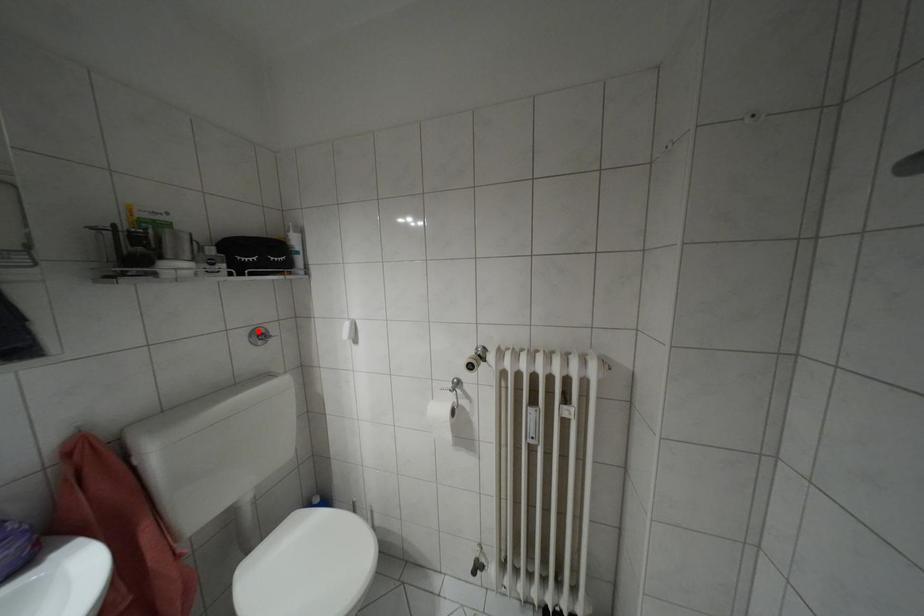
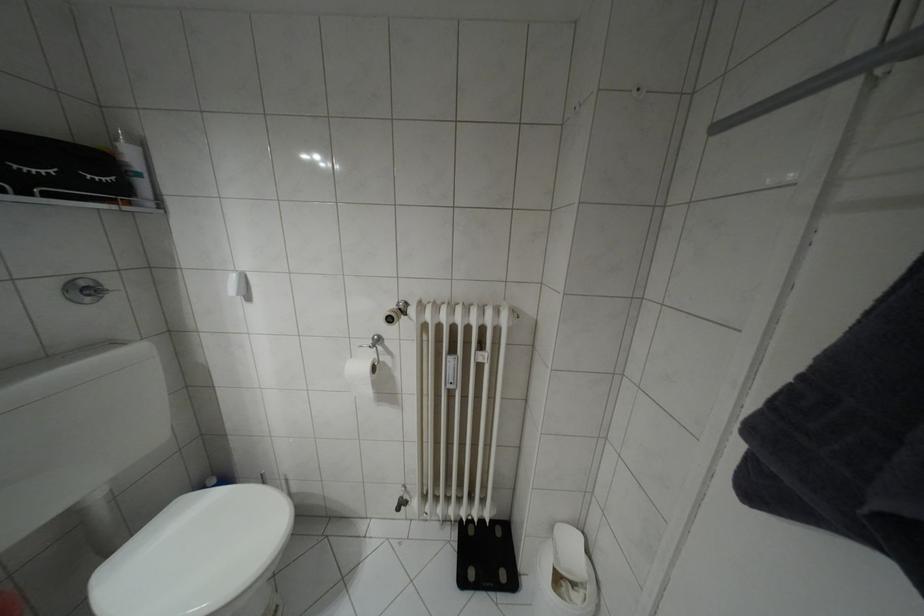
Question: I am providing you with two images of the same scene from different viewpoints. A red point is marked on the first image. At the location where the point appears in image 1, is it still visible in image 2?

Choices:
 (A) Yes
 (B) No

Answer: (A)